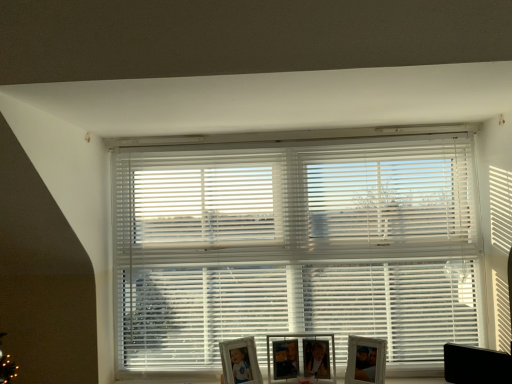
Question: Is wooden photo frame at center, the second picture frame positioned from the left, wider than black plastic swivel chair at lower right?

Choices:
 (A) yes
 (B) no

Answer: (A)

Question: From the image's perspective, is wooden photo frame at center, the second picture frame positioned from the left, on top of black plastic swivel chair at lower right?

Choices:
 (A) no
 (B) yes

Answer: (A)

Question: Is wooden photo frame at center, which ranks as the second picture frame in right-to-left order, further to camera compared to black plastic swivel chair at lower right?

Choices:
 (A) yes
 (B) no

Answer: (A)

Question: Considering the relative sizes of wooden photo frame at center, the second picture frame positioned from the left, and black plastic swivel chair at lower right in the image provided, is wooden photo frame at center, the second picture frame positioned from the left, bigger than black plastic swivel chair at lower right?

Choices:
 (A) yes
 (B) no

Answer: (A)

Question: From a real-world perspective, is wooden photo frame at center, the second picture frame positioned from the left, under black plastic swivel chair at lower right?

Choices:
 (A) no
 (B) yes

Answer: (A)

Question: From a real-world perspective, is wooden photo frame at center, the second picture frame positioned from the left, on top of black plastic swivel chair at lower right?

Choices:
 (A) no
 (B) yes

Answer: (B)

Question: Is matte silver picture frame at lower center, the 3th picture frame in the right-to-left sequence, surrounding wooden photo frame at center, the second picture frame positioned from the left?

Choices:
 (A) yes
 (B) no

Answer: (B)

Question: Considering the relative sizes of matte silver picture frame at lower center, which is the 1th picture frame from left to right, and wooden photo frame at center, which ranks as the second picture frame in right-to-left order, in the image provided, is matte silver picture frame at lower center, which is the 1th picture frame from left to right, thinner than wooden photo frame at center, which ranks as the second picture frame in right-to-left order,?

Choices:
 (A) yes
 (B) no

Answer: (B)

Question: Can we say matte silver picture frame at lower center, the 3th picture frame in the right-to-left sequence, lies outside wooden photo frame at center, the second picture frame positioned from the left?

Choices:
 (A) no
 (B) yes

Answer: (B)

Question: From the image's perspective, would you say matte silver picture frame at lower center, which is the 1th picture frame from left to right, is positioned over wooden photo frame at center, which ranks as the second picture frame in right-to-left order?

Choices:
 (A) no
 (B) yes

Answer: (A)

Question: Is matte silver picture frame at lower center, the 3th picture frame in the right-to-left sequence, to the left of wooden photo frame at center, which ranks as the second picture frame in right-to-left order, from the viewer's perspective?

Choices:
 (A) yes
 (B) no

Answer: (A)

Question: From the image's perspective, does matte silver picture frame at lower center, which is the 1th picture frame from left to right, appear lower than wooden photo frame at center, the second picture frame positioned from the left?

Choices:
 (A) no
 (B) yes

Answer: (B)

Question: Considering the relative sizes of matte silver picture frame at lower center, which is the 1th picture frame from left to right, and white plastic blinds at center in the image provided, is matte silver picture frame at lower center, which is the 1th picture frame from left to right, shorter than white plastic blinds at center?

Choices:
 (A) yes
 (B) no

Answer: (A)